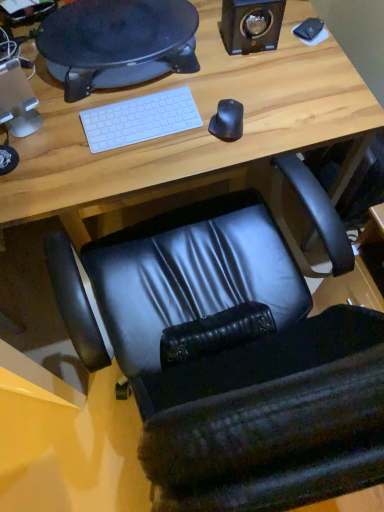
This screenshot has width=384, height=512. Find the location of `spots to the right of black matte speaker at upper right`. spots to the right of black matte speaker at upper right is located at coordinates (307, 57).